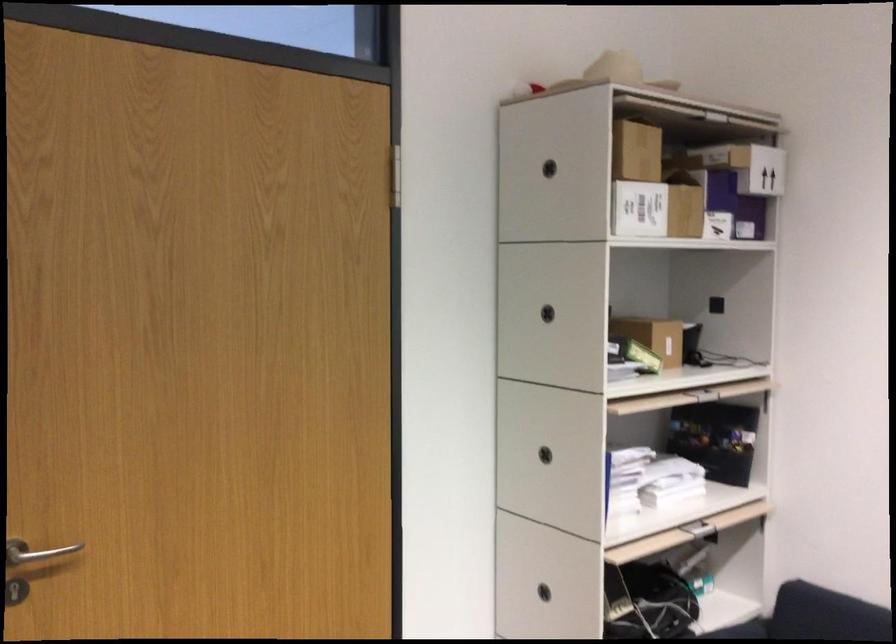
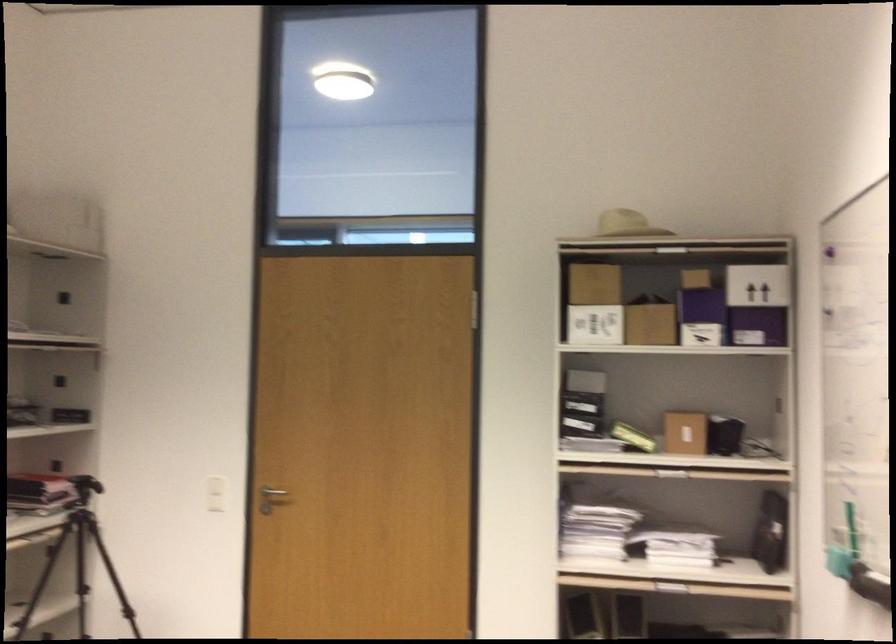
Where in the second image is the point corresponding to point 627,212 from the first image?

(595, 325)